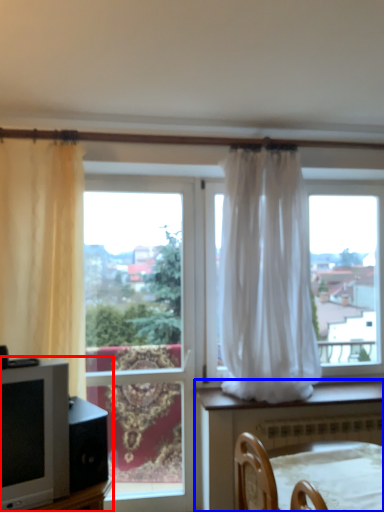
Question: Which object is further to the camera taking this photo, entertainment center (highlighted by a red box) or furniture (highlighted by a blue box)?

Choices:
 (A) entertainment center
 (B) furniture

Answer: (A)